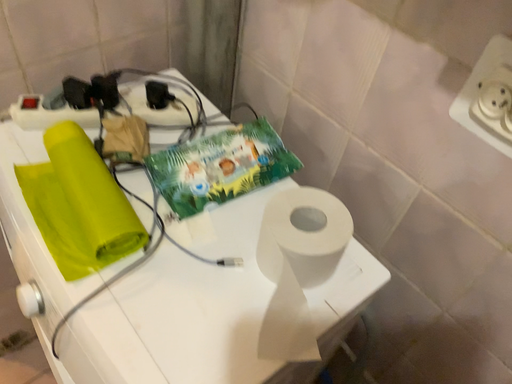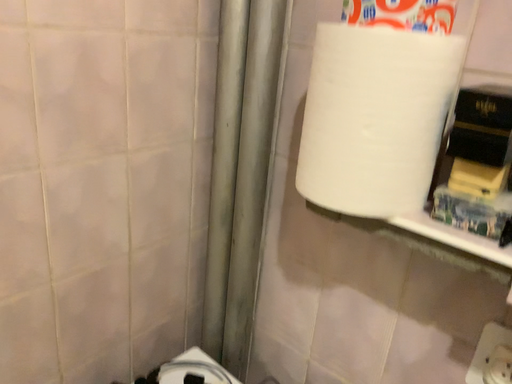
Question: How did the camera likely rotate when shooting the video?

Choices:
 (A) rotated downward
 (B) rotated upward

Answer: (B)